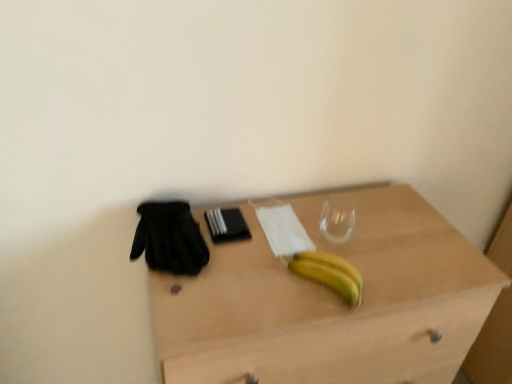
Where is `vacant space to the left of yellow matte banana at center`? The image size is (512, 384). vacant space to the left of yellow matte banana at center is located at coordinates (247, 274).